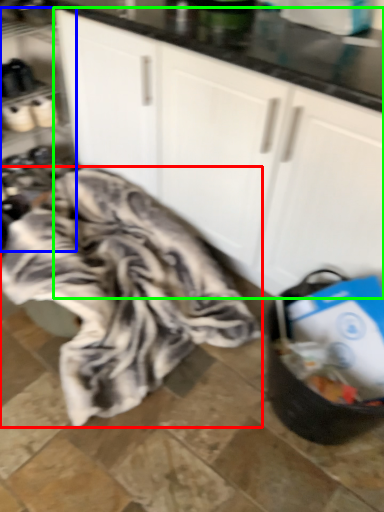
Question: Considering the real-world distances, which object is farthest from blanket (highlighted by a red box)? shelf (highlighted by a blue box) or cabinetry (highlighted by a green box)?

Choices:
 (A) shelf
 (B) cabinetry

Answer: (A)